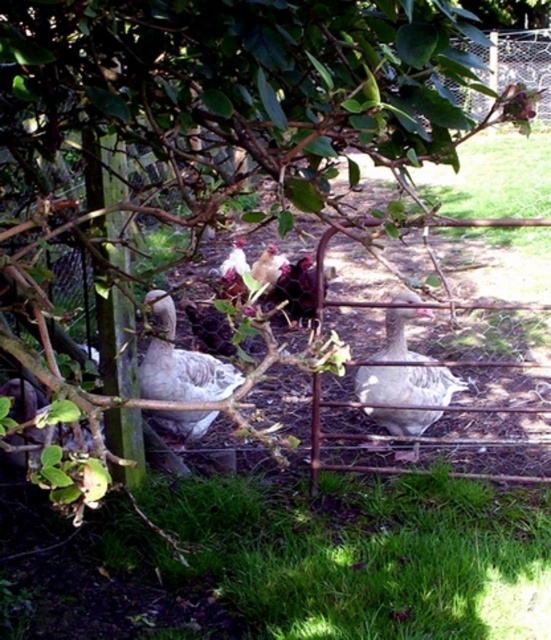
Question: Considering the real-world distances, which object is farthest from the white glossy chicken at center?

Choices:
 (A) green grass at lower center
 (B) white matte goose at center
 (C) white feathered chicken at center

Answer: (A)

Question: From the image, what is the correct spatial relationship of white glossy chicken at center in relation to white feathered chicken at center?

Choices:
 (A) above
 (B) below

Answer: (B)

Question: Is green grass at lower center bigger than white feathered chicken at center?

Choices:
 (A) no
 (B) yes

Answer: (B)

Question: Considering the real-world distances, which object is farthest from the gray matte duck at center?

Choices:
 (A) white glossy chicken at center
 (B) white feathered chicken at center
 (C) white matte goose at center
 (D) green grass at lower center

Answer: (B)

Question: Which of these objects is positioned closest to the white matte goose at center?

Choices:
 (A) green grass at lower center
 (B) white feathered chicken at center
 (C) gray matte duck at center

Answer: (C)

Question: Observing the image, what is the correct spatial positioning of white matte goose at center in reference to white feathered chicken at center?

Choices:
 (A) left
 (B) right

Answer: (B)